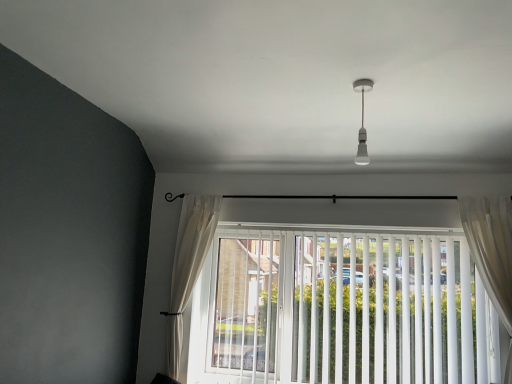
Describe the element at coordinates (492, 253) in the screenshot. I see `sheer white curtain at right, which is the first curtain in right-to-left order` at that location.

At what (x,y) coordinates should I click in order to perform the action: click on white vertical blinds at center. Please return your answer as a coordinate pair (x, y). Looking at the image, I should click on (340, 301).

The image size is (512, 384). Describe the element at coordinates (188, 266) in the screenshot. I see `white sheer curtain at left, the second curtain positioned from the front` at that location.

Locate an element on the screen. sheer white curtain at right, the 2th curtain in the left-to-right sequence is located at coordinates (492, 253).

Is white vertical blinds at center further to the viewer compared to sheer white curtain at right, the second curtain when ordered from back to front?

Yes, white vertical blinds at center is behind sheer white curtain at right, the second curtain when ordered from back to front.

From the image's perspective, which is below, white vertical blinds at center or sheer white curtain at right, the second curtain when ordered from back to front?

white vertical blinds at center appears lower in the image.

Which is more to the right, sheer white curtain at right, the 2th curtain in the left-to-right sequence, or white sheer curtain at left, the 2th curtain viewed from the right?

sheer white curtain at right, the 2th curtain in the left-to-right sequence.

Considering the sizes of objects sheer white curtain at right, the 2th curtain in the left-to-right sequence, and white sheer curtain at left, the second curtain positioned from the front, in the image provided, who is bigger, sheer white curtain at right, the 2th curtain in the left-to-right sequence, or white sheer curtain at left, the second curtain positioned from the front,?

Bigger between the two is white sheer curtain at left, the second curtain positioned from the front.

In the scene shown: In terms of width, does sheer white curtain at right, which is the first curtain in right-to-left order, look wider or thinner when compared to white sheer curtain at left, positioned as the first curtain in left-to-right order?

Considering their sizes, sheer white curtain at right, which is the first curtain in right-to-left order, looks slimmer than white sheer curtain at left, positioned as the first curtain in left-to-right order.

Does sheer white curtain at right, the 2th curtain in the left-to-right sequence, lie behind white sheer curtain at left, the first curtain when ordered from back to front?

No, it is in front of white sheer curtain at left, the first curtain when ordered from back to front.

From the image's perspective, would you say sheer white curtain at right, which is the first curtain in right-to-left order, is shown under white glossy bulb at upper center?

Indeed, from the image's perspective, sheer white curtain at right, which is the first curtain in right-to-left order, is shown beneath white glossy bulb at upper center.

Is sheer white curtain at right, the 2th curtain in the left-to-right sequence, bigger than white glossy bulb at upper center?

Correct, sheer white curtain at right, the 2th curtain in the left-to-right sequence, is larger in size than white glossy bulb at upper center.

Considering the sizes of objects sheer white curtain at right, the 2th curtain in the left-to-right sequence, and white glossy bulb at upper center in the image provided, who is wider, sheer white curtain at right, the 2th curtain in the left-to-right sequence, or white glossy bulb at upper center?

Wider between the two is sheer white curtain at right, the 2th curtain in the left-to-right sequence.

Which is behind, point (490, 287) or point (365, 139)?

Point (490, 287)

Would you consider white sheer curtain at left, the first curtain when ordered from back to front, to be distant from white vertical blinds at center?

Actually, white sheer curtain at left, the first curtain when ordered from back to front, and white vertical blinds at center are a little close together.

Is point (194, 269) farther from camera compared to point (234, 243)?

No, (194, 269) is closer to viewer.

From a real-world perspective, is white sheer curtain at left, the first curtain when ordered from back to front, positioned under white vertical blinds at center based on gravity?

No.

Between white sheer curtain at left, positioned as the first curtain in left-to-right order, and white vertical blinds at center, which one has smaller size?

With smaller size is white sheer curtain at left, positioned as the first curtain in left-to-right order.

Does white glossy bulb at upper center have a smaller size compared to sheer white curtain at right, the second curtain when ordered from back to front?

Correct, white glossy bulb at upper center occupies less space than sheer white curtain at right, the second curtain when ordered from back to front.

From a real-world perspective, between white glossy bulb at upper center and sheer white curtain at right, the second curtain when ordered from back to front, who is vertically higher?

white glossy bulb at upper center.

Which of these two, white glossy bulb at upper center or sheer white curtain at right, the 1th curtain positioned from the front, is wider?

With larger width is sheer white curtain at right, the 1th curtain positioned from the front.

Is white glossy bulb at upper center positioned with its back to sheer white curtain at right, the 1th curtain positioned from the front?

No, white glossy bulb at upper center is not facing away from sheer white curtain at right, the 1th curtain positioned from the front.

Considering the relative sizes of white vertical blinds at center and white sheer curtain at left, the second curtain positioned from the front, in the image provided, is white vertical blinds at center smaller than white sheer curtain at left, the second curtain positioned from the front,?

Incorrect, white vertical blinds at center is not smaller in size than white sheer curtain at left, the second curtain positioned from the front.

This screenshot has height=384, width=512. Find the location of `curtain that is the 1st one above the white vertical blinds at center (from a real-world perspective)`. curtain that is the 1st one above the white vertical blinds at center (from a real-world perspective) is located at coordinates (188, 266).

Would you say white sheer curtain at left, the first curtain when ordered from back to front, is part of white vertical blinds at center's contents?

Actually, white sheer curtain at left, the first curtain when ordered from back to front, is outside white vertical blinds at center.

Can you confirm if white glossy bulb at upper center is positioned to the right of white sheer curtain at left, the second curtain positioned from the front?

Yes.

Considering the points (359, 160) and (188, 241), which point is in front, point (359, 160) or point (188, 241)?

The point (359, 160) is in front.

Can you confirm if white glossy bulb at upper center is taller than white sheer curtain at left, the 2th curtain viewed from the right?

No.

From a real-world perspective, does white glossy bulb at upper center stand above white sheer curtain at left, the 2th curtain viewed from the right?

Yes.

This screenshot has height=384, width=512. I want to click on curtain on the right of white vertical blinds at center, so click(492, 253).

At what (x,y) coordinates should I click in order to perform the action: click on curtain that appears in front of the white sheer curtain at left, the first curtain when ordered from back to front. Please return your answer as a coordinate pair (x, y). The width and height of the screenshot is (512, 384). Looking at the image, I should click on (492, 253).

When comparing their distances from white sheer curtain at left, the second curtain positioned from the front, does sheer white curtain at right, the 1th curtain positioned from the front, or white vertical blinds at center seem further?

sheer white curtain at right, the 1th curtain positioned from the front, lies further to white sheer curtain at left, the second curtain positioned from the front, than the other object.

Based on their spatial positions, is white vertical blinds at center or white sheer curtain at left, the second curtain positioned from the front, closer to white glossy bulb at upper center?

white vertical blinds at center is closer to white glossy bulb at upper center.

Considering their positions, is white glossy bulb at upper center positioned closer to sheer white curtain at right, which is the first curtain in right-to-left order, than white vertical blinds at center?

Among the two, white vertical blinds at center is located nearer to sheer white curtain at right, which is the first curtain in right-to-left order.

Considering their positions, is white sheer curtain at left, the first curtain when ordered from back to front, positioned further to white glossy bulb at upper center than white vertical blinds at center?

Based on the image, white sheer curtain at left, the first curtain when ordered from back to front, appears to be further to white glossy bulb at upper center.

Looking at the image, which one is located closer to white vertical blinds at center, sheer white curtain at right, which is the first curtain in right-to-left order, or white sheer curtain at left, the second curtain positioned from the front?

sheer white curtain at right, which is the first curtain in right-to-left order, lies closer to white vertical blinds at center than the other object.

Consider the image. Looking at the image, which one is located closer to white vertical blinds at center, white sheer curtain at left, the first curtain when ordered from back to front, or white glossy bulb at upper center?

The object closer to white vertical blinds at center is white sheer curtain at left, the first curtain when ordered from back to front.

Looking at the image, which one is located further to white glossy bulb at upper center, white vertical blinds at center or sheer white curtain at right, which is the first curtain in right-to-left order?

Based on the image, white vertical blinds at center appears to be further to white glossy bulb at upper center.

When comparing their distances from sheer white curtain at right, which is the first curtain in right-to-left order, does white sheer curtain at left, the first curtain when ordered from back to front, or white vertical blinds at center seem further?

white sheer curtain at left, the first curtain when ordered from back to front, is positioned further to the anchor sheer white curtain at right, which is the first curtain in right-to-left order.

The width and height of the screenshot is (512, 384). In order to click on light fixture between white sheer curtain at left, positioned as the first curtain in left-to-right order, and sheer white curtain at right, which is the first curtain in right-to-left order, in the horizontal direction in this screenshot , I will do `click(362, 123)`.

The image size is (512, 384). Find the location of `window between white sheer curtain at left, the 2th curtain viewed from the right, and sheer white curtain at right, which is the first curtain in right-to-left order, from left to right`. window between white sheer curtain at left, the 2th curtain viewed from the right, and sheer white curtain at right, which is the first curtain in right-to-left order, from left to right is located at coordinates (340, 301).